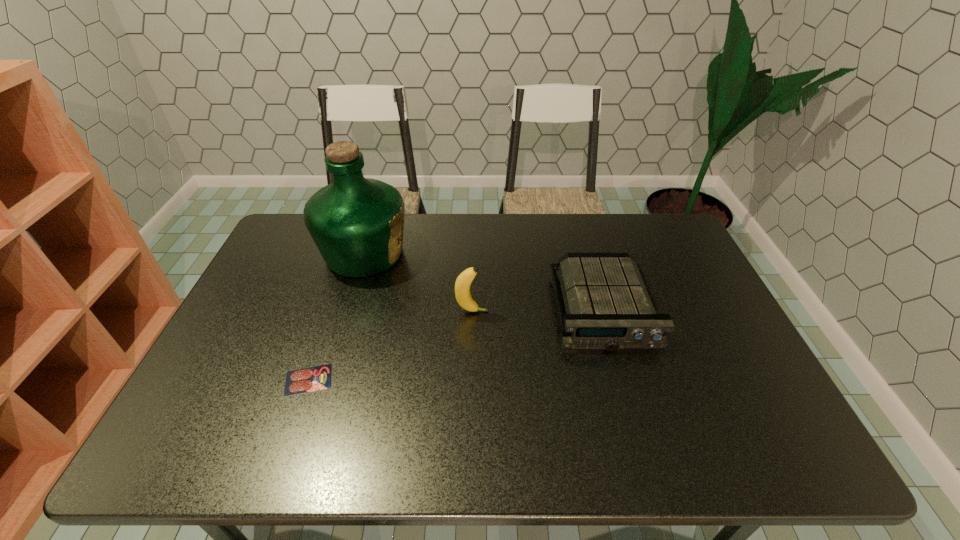
Identify the location of liquor. (357, 223).

This screenshot has height=540, width=960. Find the location of `banana`. banana is located at coordinates (463, 282).

At what (x,y) coordinates should I click in order to perform the action: click on the second tallest object. Please return your answer as a coordinate pair (x, y). This screenshot has width=960, height=540. Looking at the image, I should click on pyautogui.click(x=463, y=282).

Identify the location of the third tallest object. Image resolution: width=960 pixels, height=540 pixels. (609, 305).

You are a GUI agent. You are given a task and a screenshot of the screen. Output one action in this format:
    pyautogui.click(x=<x>, y=<y>)
    Task: Click on the rightmost object
    Image resolution: width=960 pixels, height=540 pixels.
    Given the screenshot: What is the action you would take?
    pyautogui.click(x=609, y=305)

Where is `salami`? This screenshot has width=960, height=540. salami is located at coordinates (316, 378).

This screenshot has height=540, width=960. Find the location of `the nearest object`. the nearest object is located at coordinates (316, 378).

Identify the location of free spot located on the label side of the tallest object. (428, 253).

What are the coordinates of `vacant position located from the stem of the third shortest object` in the screenshot? It's located at (554, 312).

Identify the location of vacant space located 0.190m on the front panel of the third tallest object. The width and height of the screenshot is (960, 540). (635, 418).